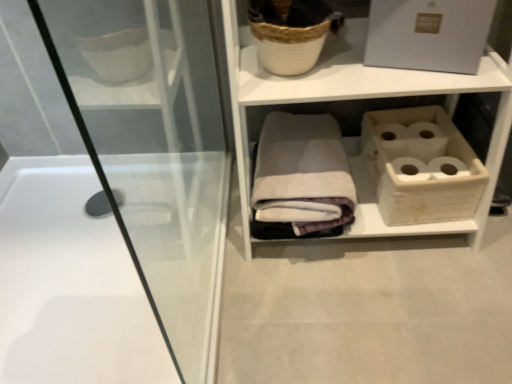
Where is `white woven basket at upper center`? The height and width of the screenshot is (384, 512). white woven basket at upper center is located at coordinates (360, 98).

Is point (103, 284) closer to camera compared to point (489, 152)?

No.

How distant is white glossy bathtub at left from white woven basket at upper center?

They are 23.96 inches apart.

Considering the positions of objects white glossy bathtub at left and white woven basket at upper center in the image provided, who is in front, white glossy bathtub at left or white woven basket at upper center?

white woven basket at upper center is in front.

You are a GUI agent. You are given a task and a screenshot of the screen. Output one action in this format:
    pyautogui.click(x=<x>, y=<y>)
    Task: Click on the bath towel behind the white woven basket at upper center
    
    Given the screenshot: What is the action you would take?
    pyautogui.click(x=302, y=174)

Is white woven basket at upper center not within gray cotton bath towel at center?

Indeed, white woven basket at upper center is completely outside gray cotton bath towel at center.

Considering the positions of objects white woven basket at upper center and gray cotton bath towel at center in the image provided, who is more to the right, white woven basket at upper center or gray cotton bath towel at center?

white woven basket at upper center is more to the right.

Is gray cotton bath towel at center facing towards white glossy bathtub at left?

No, gray cotton bath towel at center is not oriented towards white glossy bathtub at left.

Between gray cotton bath towel at center and white glossy bathtub at left, which one has less height?

white glossy bathtub at left.

From a real-world perspective, which is physically below, gray cotton bath towel at center or white glossy bathtub at left?

white glossy bathtub at left, from a real-world perspective.

Is the position of gray cotton bath towel at center more distant than that of white glossy bathtub at left?

Yes, gray cotton bath towel at center is behind white glossy bathtub at left.

From a real-world perspective, is white woven basket at upper center located higher than white glossy bathtub at left?

Correct, in the physical world, white woven basket at upper center is higher than white glossy bathtub at left.

Can you confirm if white woven basket at upper center is positioned to the left of white glossy bathtub at left?

No.

Which of these two, white woven basket at upper center or white glossy bathtub at left, stands taller?

With more height is white woven basket at upper center.

Does white woven basket at upper center touch white glossy bathtub at left?

There is a gap between white woven basket at upper center and white glossy bathtub at left.

Can we say white glossy bathtub at left lies outside gray cotton bath towel at center?

Absolutely, white glossy bathtub at left is external to gray cotton bath towel at center.

Does point (118, 301) come in front of point (294, 228)?

That is True.

Is white glossy bathtub at left behind gray cotton bath towel at center?

No, it is not.

Visually, is white glossy bathtub at left positioned to the left or to the right of gray cotton bath towel at center?

white glossy bathtub at left is to the left of gray cotton bath towel at center.

Which object is wider, gray cotton bath towel at center or white woven basket at upper center?

Wider between the two is gray cotton bath towel at center.

Is white woven basket at upper center located within gray cotton bath towel at center?

That's incorrect, white woven basket at upper center is not inside gray cotton bath towel at center.

The image size is (512, 384). What are the coordinates of `shelf that is above the gray cotton bath towel at center (from a real-world perspective)` in the screenshot? It's located at (360, 98).

Is gray cotton bath towel at center not near white woven basket at upper center?

That's not correct — gray cotton bath towel at center is a little close to white woven basket at upper center.

This screenshot has height=384, width=512. In the image, there is a white glossy bathtub at left. What are the coordinates of `shelf above it (from the image's perspective)` in the screenshot? It's located at (360, 98).

The height and width of the screenshot is (384, 512). Identify the location of bath towel behind the white woven basket at upper center. (302, 174).

Based on their spatial positions, is white glossy bathtub at left or white woven basket at upper center further from gray cotton bath towel at center?

Among the two, white glossy bathtub at left is located further to gray cotton bath towel at center.

From the image, which object appears to be farther from white woven basket at upper center, gray cotton bath towel at center or white glossy bathtub at left?

Based on the image, white glossy bathtub at left appears to be further to white woven basket at upper center.

Looking at this image, based on their spatial positions, is white woven basket at upper center or white glossy bathtub at left further from gray cotton bath towel at center?

Based on the image, white glossy bathtub at left appears to be further to gray cotton bath towel at center.

Considering their positions, is white glossy bathtub at left positioned further to white woven basket at upper center than gray cotton bath towel at center?

white glossy bathtub at left.

Looking at the image, which one is located closer to white glossy bathtub at left, white woven basket at upper center or gray cotton bath towel at center?

Among the two, gray cotton bath towel at center is located nearer to white glossy bathtub at left.

When comparing their distances from white glossy bathtub at left, does gray cotton bath towel at center or white woven basket at upper center seem closer?

Among the two, gray cotton bath towel at center is located nearer to white glossy bathtub at left.

Image resolution: width=512 pixels, height=384 pixels. I want to click on bath towel situated between white glossy bathtub at left and white woven basket at upper center from left to right, so click(x=302, y=174).